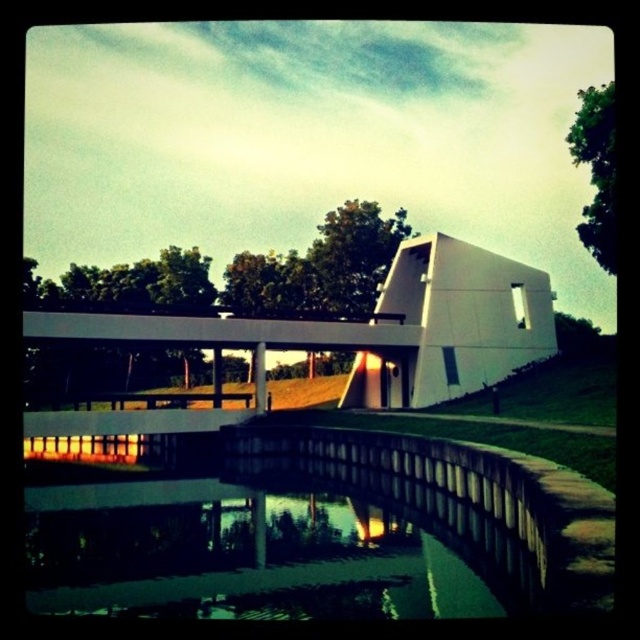
You are standing at the base of the grassy hillside looking towards the modern architectural structure. You see the green reflective water at lower center and the white smooth bridge at center. Which object is closer to you?

The green reflective water at lower center is closer to the viewer than the white smooth bridge at center.

What is the 2D coordinate of the green reflective water at lower center?

The 2D coordinate of the green reflective water at lower center is at point (236, 556).

You are standing at the point labeled as point (236, 556) in the image. What is the surface you are standing on?

The point (236, 556) is on green reflective water at lower center, so the surface you are standing on is the green reflective water at lower center.